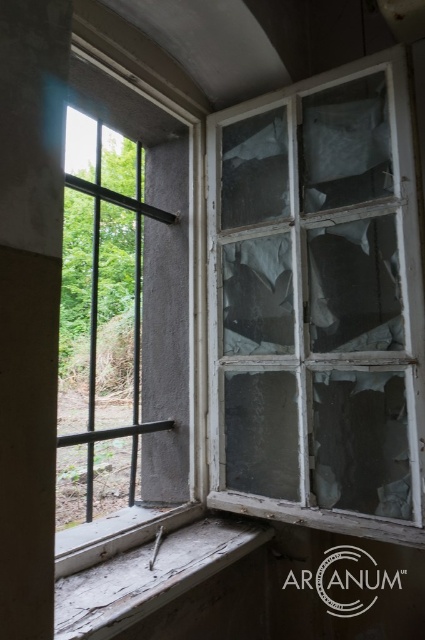
Can you confirm if transparent glass window at right is positioned below transparent glass window at center?

No, transparent glass window at right is not below transparent glass window at center.

Can you confirm if transparent glass window at right is shorter than transparent glass window at center?

Yes.

Which is behind, point (271, 438) or point (96, 212)?

The point (96, 212) is more distant.

At what (x,y) coordinates should I click in order to perform the action: click on transparent glass window at right. Please return your answer as a coordinate pair (x, y). Looking at the image, I should click on (317, 305).

Which of these two, transparent glass window at center or weathered wood at lower left, stands shorter?

weathered wood at lower left

Which is in front, point (184, 397) or point (255, 534)?

Point (255, 534) is more forward.

Find the location of a particular element. The width and height of the screenshot is (425, 640). transparent glass window at center is located at coordinates (129, 310).

Find the location of `transparent glass window at center`. transparent glass window at center is located at coordinates (129, 310).

Is point (396, 205) positioned after point (74, 621)?

Yes, it is.

I want to click on transparent glass window at right, so pos(317,305).

Measure the distance between point (252,141) and camera.

Point (252,141) is 5.99 feet away from camera.

At what (x,y) coordinates should I click in order to perform the action: click on transparent glass window at right. Please return your answer as a coordinate pair (x, y). Looking at the image, I should click on click(x=317, y=305).